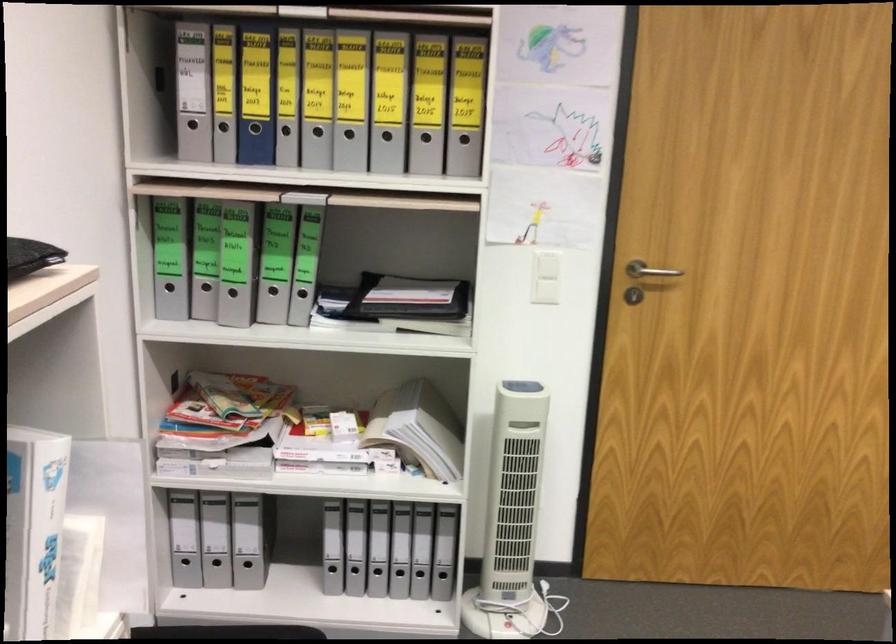
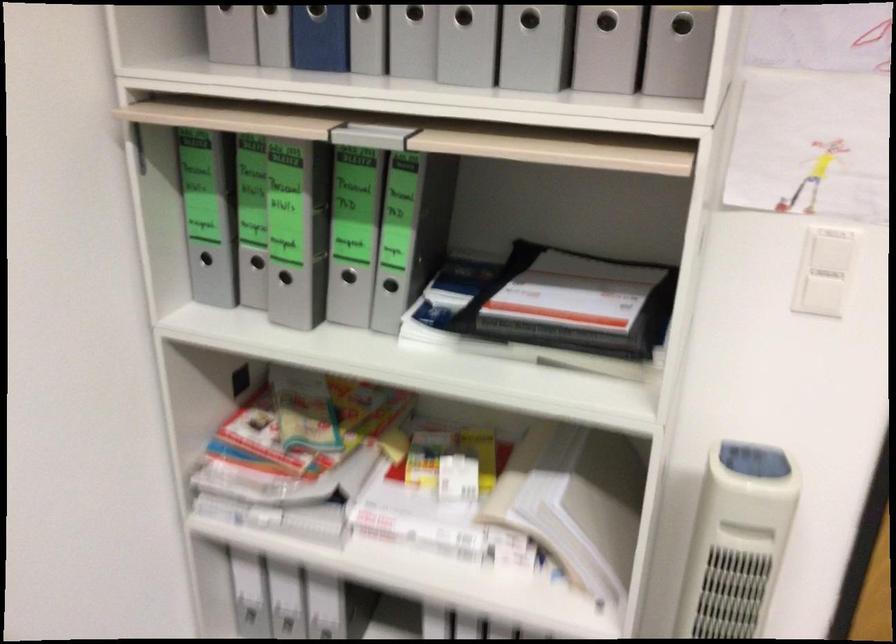
Where in the second image is the point corresponding to (556,266) from the first image?

(831, 252)